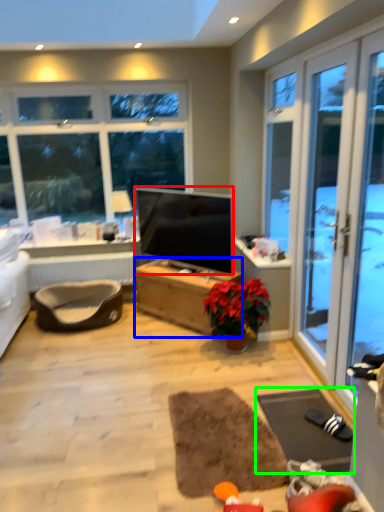
Question: Based on their relative distances, which object is farther from television (highlighted by a red box)? Choose from desk (highlighted by a blue box) and yoga mat (highlighted by a green box).

Choices:
 (A) desk
 (B) yoga mat

Answer: (B)